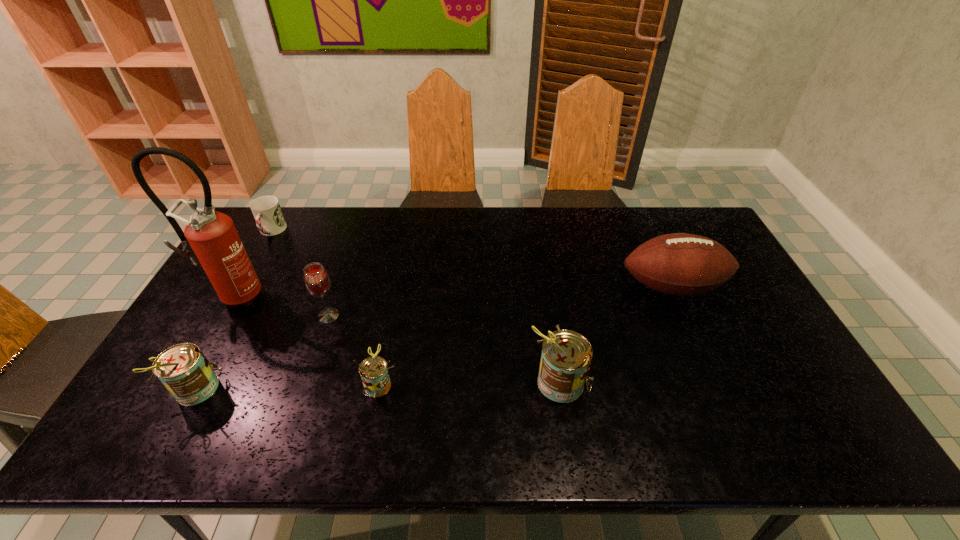
Locate an element on the screen. The width and height of the screenshot is (960, 540). free space located 0.220m on the right of the sixth object from left to right is located at coordinates (678, 382).

You are a GUI agent. You are given a task and a screenshot of the screen. Output one action in this format:
    pyautogui.click(x=<x>, y=<y>)
    Task: Click on the free space located 0.250m on the handle side of the farthest object
    The image size is (960, 540).
    Given the screenshot: What is the action you would take?
    pyautogui.click(x=236, y=294)

Locate an element on the screen. The height and width of the screenshot is (540, 960). vacant space located 0.240m on the back of the football (American) is located at coordinates (643, 224).

You are a GUI agent. You are given a task and a screenshot of the screen. Output one action in this format:
    pyautogui.click(x=<x>, y=<y>)
    Task: Click on the free region located on the right of the wineglass
    
    Given the screenshot: What is the action you would take?
    pyautogui.click(x=420, y=316)

This screenshot has height=540, width=960. Find the location of `vacant space located 0.190m at the nozzle of the fire extinguisher`. vacant space located 0.190m at the nozzle of the fire extinguisher is located at coordinates (196, 366).

I want to click on object positioned at the far edge, so (267, 212).

Find the location of `can that is positioned at the left edge`. can that is positioned at the left edge is located at coordinates (184, 370).

The image size is (960, 540). What are the coordinates of `cup that is at the left edge` in the screenshot? It's located at (267, 212).

Find the location of a particular element. Image resolution: width=960 pixels, height=540 pixels. fire extinguisher positioned at the left edge is located at coordinates (210, 238).

Locate an element on the screen. This screenshot has width=960, height=540. object that is at the right edge is located at coordinates (679, 264).